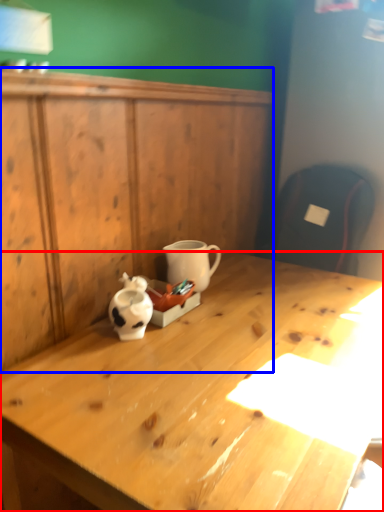
Question: Which of the following is the closest to the observer, desk (highlighted by a red box) or dresser (highlighted by a blue box)?

Choices:
 (A) desk
 (B) dresser

Answer: (A)